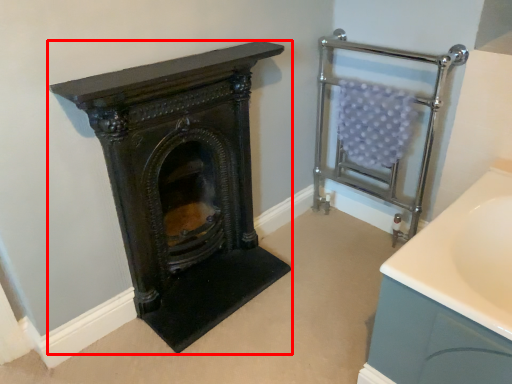
Question: Considering the relative positions of wood burning stove (annotated by the red box) and balustrade in the image provided, where is wood burning stove (annotated by the red box) located with respect to the staircase?

Choices:
 (A) right
 (B) left

Answer: (B)